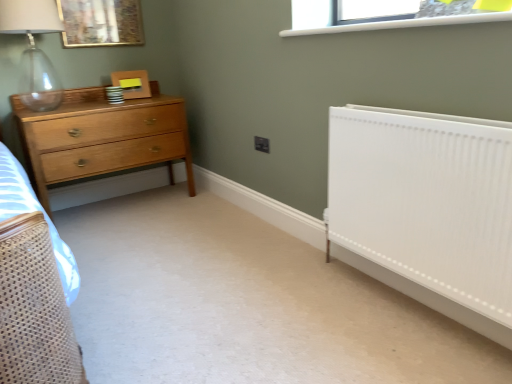
Image resolution: width=512 pixels, height=384 pixels. I want to click on vacant space in front of light brown wood chest of drawers at left, so click(x=142, y=241).